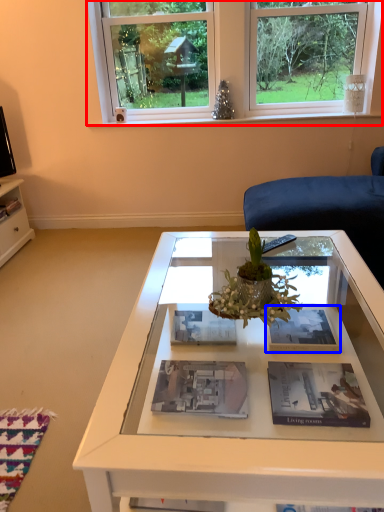
Question: Among these objects, which one is nearest to the camera, window (highlighted by a red box) or magazine (highlighted by a blue box)?

Choices:
 (A) window
 (B) magazine

Answer: (B)